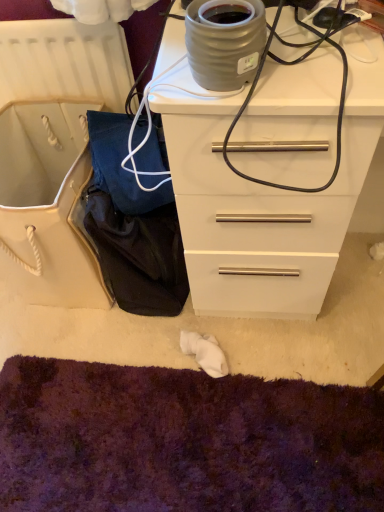
The image size is (384, 512). Identify the location of free space to the left of matte gray ceramic pot at upper center. (168, 82).